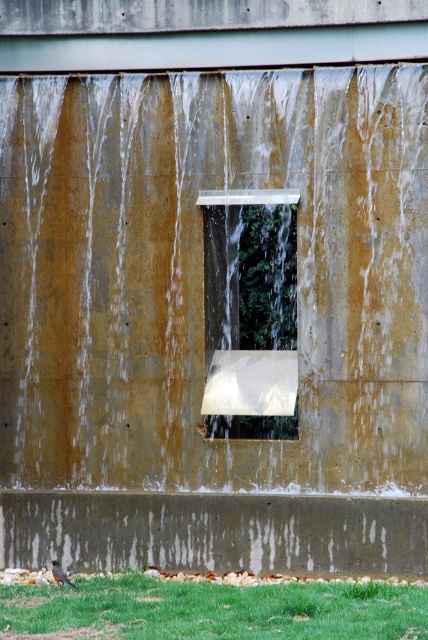
From the picture: You are standing in front of the water wall installation and notice two points marked on the wall. The first point is at coordinates point [27,314] and the second is at point [252,602]. From your perspective, which point is closer to you?

Point [252,602] is closer to you because it is in front of point [27,314].

Consider the image. You are standing in front of the water wall installation and want to place a small potted plant between the concrete rough at lower center and the green grass at lower center. Can you do this without the plant being hidden from view?

The concrete rough at lower center is further to the viewer than green grass at lower center, so placing the potted plant between them would require positioning it closer to the grass. However, since the concrete is closer to you, the plant placed between them might still be partially obscured by the concrete, making it less visible from your current position.

You are an architect designing a new building and want to incorporate both the clear concrete waterfall at center and the clear glass window at center into the design. Based on the scene description, which object is taller and would require more vertical space in the design?

The clear concrete waterfall at center is taller than the clear glass window at center, so it requires more vertical space in the design.